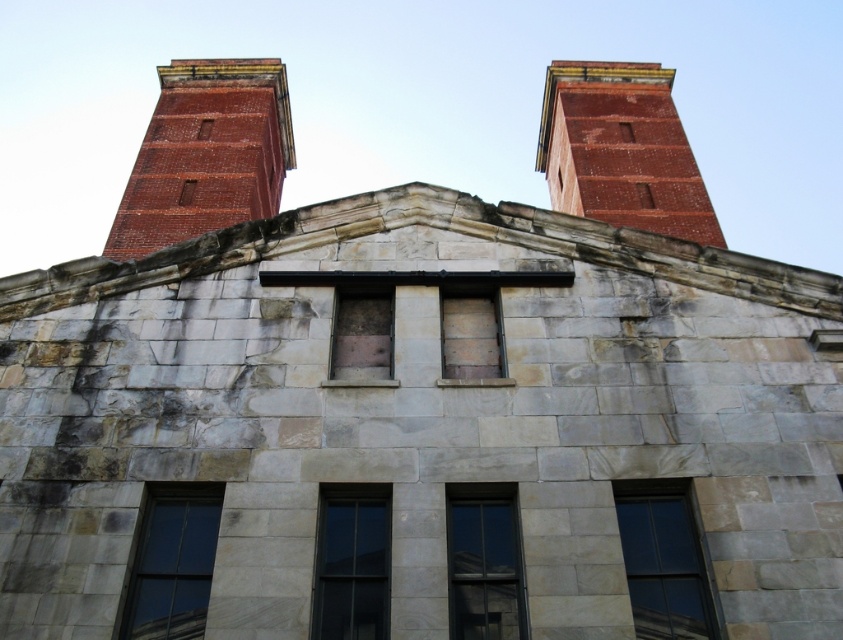
Does transparent glass window at center appear on the right side of wooden boarded window at center?

No, transparent glass window at center is not to the right of wooden boarded window at center.

Which is behind, point (330, 548) or point (450, 348)?

The point (450, 348) is more distant.

What do you see at coordinates (352, 563) in the screenshot? I see `transparent glass window at center` at bounding box center [352, 563].

Where is `transparent glass window at center`? This screenshot has height=640, width=843. transparent glass window at center is located at coordinates (352, 563).

Does transparent glass window at center appear over clear glass window at center?

Yes.

Can you confirm if transparent glass window at center is bigger than clear glass window at center?

Indeed, transparent glass window at center has a larger size compared to clear glass window at center.

Locate an element on the screen. transparent glass window at center is located at coordinates (352, 563).

Between point (196, 595) and point (366, 611), which one is positioned in front?

Positioned in front is point (366, 611).

I want to click on clear glass window at lower left, so click(173, 563).

Is point (201, 493) positioned before point (382, 554)?

No, it is not.

Image resolution: width=843 pixels, height=640 pixels. In order to click on clear glass window at lower left in this screenshot , I will do `click(173, 563)`.